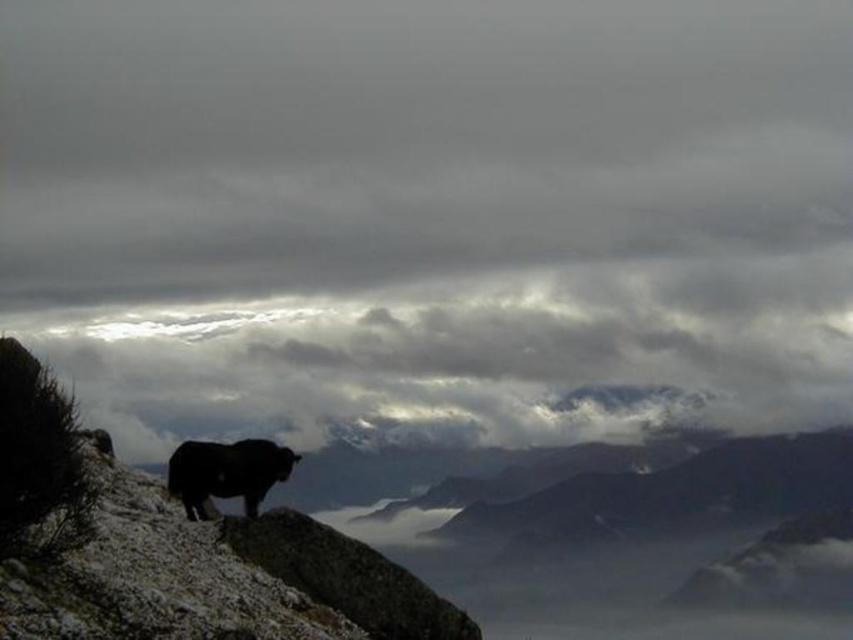
Question: Which of the following is the closest to the observer?

Choices:
 (A) black fur at center
 (B) cloudy gray sky at upper center

Answer: (B)

Question: Can you confirm if cloudy gray sky at upper center is wider than black fur at center?

Choices:
 (A) yes
 (B) no

Answer: (A)

Question: Considering the relative positions of cloudy gray sky at upper center and black fur at center in the image provided, where is cloudy gray sky at upper center located with respect to black fur at center?

Choices:
 (A) left
 (B) right

Answer: (A)

Question: Can you confirm if cloudy gray sky at upper center is positioned to the right of black fur at center?

Choices:
 (A) yes
 (B) no

Answer: (B)

Question: Which point is farther to the camera?

Choices:
 (A) cloudy gray sky at upper center
 (B) black fur at center

Answer: (B)